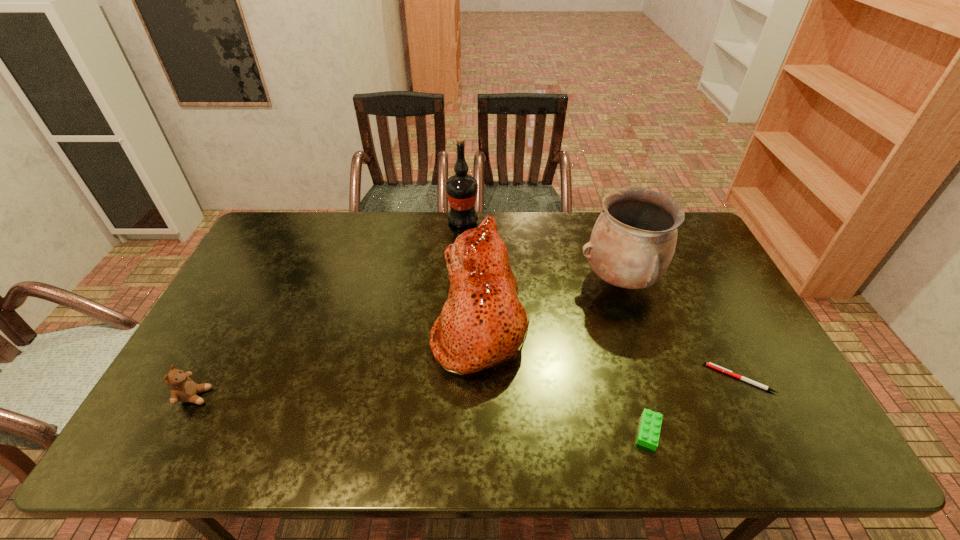
This screenshot has width=960, height=540. Identify the location of free area in between the pen and the cat. (610, 350).

You are a GUI agent. You are given a task and a screenshot of the screen. Output one action in this format:
    pyautogui.click(x=<x>, y=<y>)
    Task: Click on the unoccupied position between the cat and the fourth tallest object
    This screenshot has width=960, height=540.
    Given the screenshot: What is the action you would take?
    pyautogui.click(x=338, y=360)

The image size is (960, 540). I want to click on vacant region between the fifth tallest object and the cat, so click(564, 377).

I want to click on vacant space in between the cat and the third shortest object, so click(338, 360).

Where is `unoccupied position between the farthest object and the urn`? This screenshot has width=960, height=540. unoccupied position between the farthest object and the urn is located at coordinates (541, 251).

In order to click on vacant area that lies between the teddy bear and the shortest object in this screenshot , I will do point(467,387).

Find the location of a particular element. Image resolution: width=960 pixels, height=540 pixels. free space between the farthest object and the leftmost object is located at coordinates point(329,309).

The image size is (960, 540). I want to click on the second closest object to the leftmost object, so click(461, 189).

The height and width of the screenshot is (540, 960). I want to click on object that stands as the closest to the rightmost object, so click(649, 431).

The width and height of the screenshot is (960, 540). Identify the location of free space that satisfies the following two spatial constraints: 1. on the front-facing side of the Lego; 2. on the left side of the teddy bear. click(177, 431).